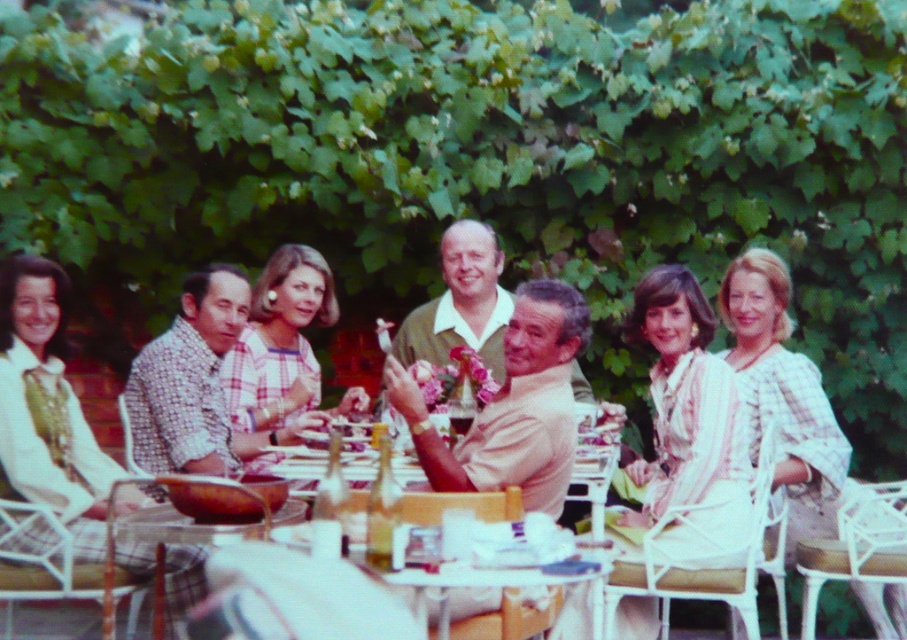
Question: Does clear glass table at center lie in front of light beige fabric shirt at center?

Choices:
 (A) no
 (B) yes

Answer: (B)

Question: Does clear glass table at center have a larger size compared to light beige fabric shirt at center?

Choices:
 (A) no
 (B) yes

Answer: (B)

Question: In this image, where is clear glass table at center located relative to light beige fabric shirt at center?

Choices:
 (A) above
 (B) below

Answer: (B)

Question: Which object appears farthest from the camera in this image?

Choices:
 (A) light beige fabric shirt at center
 (B) clear glass table at center

Answer: (A)